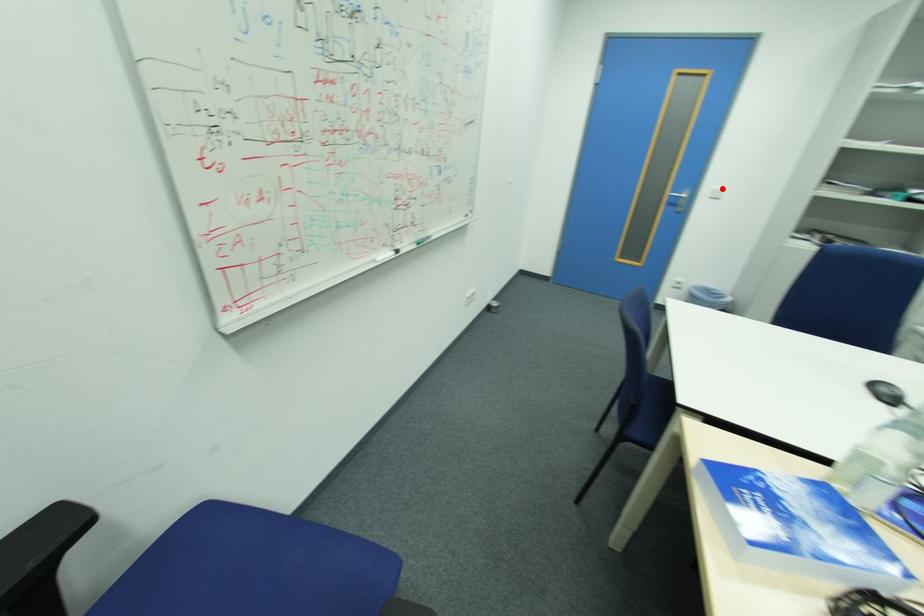
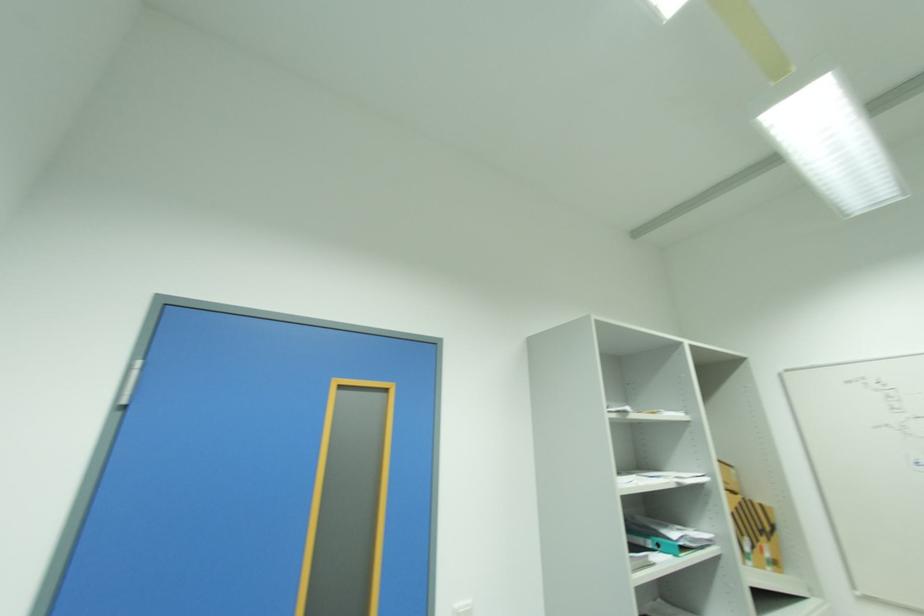
In the second image, find the point that corresponds to the highlighted location in the first image.

(463, 604)